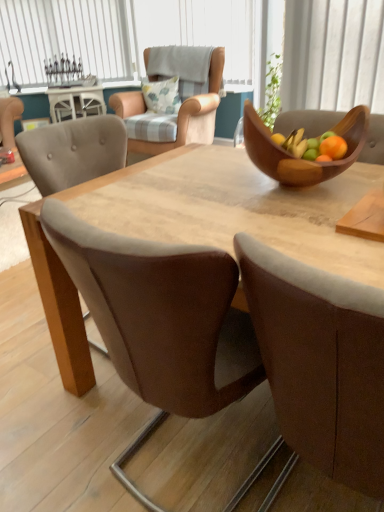
Question: Is brown leather chair at center, which is the 2th chair from top to bottom, at the left side of white vertical blinds at upper left?

Choices:
 (A) no
 (B) yes

Answer: (A)

Question: Is brown leather chair at center, which is the 2th chair from top to bottom, positioned with its back to white vertical blinds at upper left?

Choices:
 (A) no
 (B) yes

Answer: (A)

Question: From a real-world perspective, is brown leather chair at center, which is the 2th chair from top to bottom, physically below white vertical blinds at upper left?

Choices:
 (A) no
 (B) yes

Answer: (B)

Question: Can you see brown leather chair at center, the second chair positioned from the back, touching white vertical blinds at upper left?

Choices:
 (A) yes
 (B) no

Answer: (B)

Question: Is brown leather chair at center, which appears as the first chair when viewed from the front, positioned in front of white vertical blinds at upper left?

Choices:
 (A) no
 (B) yes

Answer: (B)

Question: From the image's perspective, is light brown fabric armchair at upper center, which ranks as the 1th chair in back-to-front order, located above or below white glossy cabinet at upper left?

Choices:
 (A) above
 (B) below

Answer: (B)

Question: Is light brown fabric armchair at upper center, which is the 2th chair in bottom-to-top order, inside or outside of white glossy cabinet at upper left?

Choices:
 (A) outside
 (B) inside

Answer: (A)

Question: In terms of width, does light brown fabric armchair at upper center, which ranks as the 1th chair in back-to-front order, look wider or thinner when compared to white glossy cabinet at upper left?

Choices:
 (A) wide
 (B) thin

Answer: (A)

Question: Is light brown fabric armchair at upper center, which is the 2th chair in bottom-to-top order, taller or shorter than white glossy cabinet at upper left?

Choices:
 (A) tall
 (B) short

Answer: (A)

Question: Would you say white vertical blinds at upper left is inside or outside light brown fabric armchair at upper center, which ranks as the 1th chair in back-to-front order?

Choices:
 (A) outside
 (B) inside

Answer: (A)

Question: In terms of width, does white vertical blinds at upper left look wider or thinner when compared to light brown fabric armchair at upper center, positioned as the 2th chair in front-to-back order?

Choices:
 (A) thin
 (B) wide

Answer: (A)

Question: Would you say white vertical blinds at upper left is to the left or to the right of light brown fabric armchair at upper center, which is the 2th chair in bottom-to-top order, in the picture?

Choices:
 (A) left
 (B) right

Answer: (A)

Question: Does point (29, 37) appear closer or farther from the camera than point (163, 151)?

Choices:
 (A) farther
 (B) closer

Answer: (A)

Question: From a real-world perspective, is light brown wooden table at center above or below fluffy white pillow at upper center?

Choices:
 (A) above
 (B) below

Answer: (B)

Question: From the image's perspective, is light brown wooden table at center positioned above or below fluffy white pillow at upper center?

Choices:
 (A) above
 (B) below

Answer: (B)